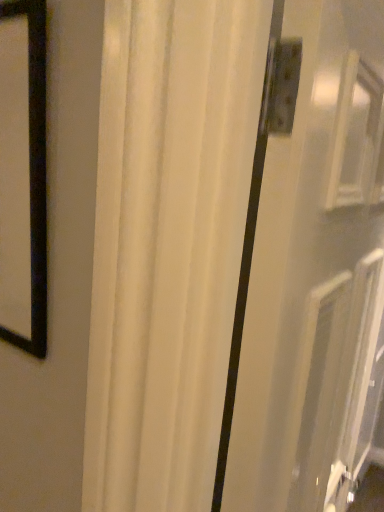
What is the approximate width of white glossy screen door at center?

4.01 inches.

The image size is (384, 512). Describe the element at coordinates (314, 268) in the screenshot. I see `white glossy screen door at center` at that location.

You are a GUI agent. You are given a task and a screenshot of the screen. Output one action in this format:
    pyautogui.click(x=<x>, y=<y>)
    Task: Click on the white glossy screen door at center
    
    Given the screenshot: What is the action you would take?
    pyautogui.click(x=314, y=268)

The image size is (384, 512). Find the location of `white matte curtain at center`. white matte curtain at center is located at coordinates (168, 244).

The height and width of the screenshot is (512, 384). Describe the element at coordinates (168, 244) in the screenshot. I see `white matte curtain at center` at that location.

Locate an element on the screen. Image resolution: width=384 pixels, height=512 pixels. white glossy screen door at center is located at coordinates (314, 268).

Considering the positions of objects white glossy screen door at center and white matte curtain at center in the image provided, who is more to the left, white glossy screen door at center or white matte curtain at center?

From the viewer's perspective, white glossy screen door at center appears more on the left side.

Considering the positions of objects white glossy screen door at center and white matte curtain at center in the image provided, who is in front, white glossy screen door at center or white matte curtain at center?

white glossy screen door at center is more forward.

Which is farther from the camera, (315, 332) or (166, 7)?

Point (315, 332)

From the image's perspective, is white glossy screen door at center located beneath white matte curtain at center?

No.

From a real-world perspective, is white glossy screen door at center physically below white matte curtain at center?

Incorrect, from a real-world perspective, white glossy screen door at center is higher than white matte curtain at center.

Which object is thinner, white glossy screen door at center or white matte curtain at center?

white glossy screen door at center is thinner.

Is white glossy screen door at center shorter than white matte curtain at center?

Yes.

Is white glossy screen door at center bigger than white matte curtain at center?

Incorrect, white glossy screen door at center is not larger than white matte curtain at center.

Based on the photo, is white matte curtain at center a part of white glossy screen door at center?

No, white glossy screen door at center does not contain white matte curtain at center.

Is white glossy screen door at center positioned far away from white matte curtain at center?

white glossy screen door at center is near white matte curtain at center, not far away.

Does white glossy screen door at center turn towards white matte curtain at center?

No, white glossy screen door at center is not oriented towards white matte curtain at center.

Locate an element on the screen. The width and height of the screenshot is (384, 512). screen door above the white matte curtain at center (from the image's perspective) is located at coordinates (314, 268).

Considering the positions of objects white matte curtain at center and white glossy screen door at center in the image provided, who is more to the left, white matte curtain at center or white glossy screen door at center?

white glossy screen door at center.

Is white matte curtain at center further to camera compared to white glossy screen door at center?

Yes, white matte curtain at center is further from the camera.

Between point (126, 232) and point (266, 230), which one is positioned in front?

The point (126, 232) is in front.

From the image's perspective, which object appears higher, white matte curtain at center or white glossy screen door at center?

white glossy screen door at center, from the image's perspective.

From a real-world perspective, is white matte curtain at center positioned over white glossy screen door at center based on gravity?

No, from a real-world perspective, white matte curtain at center is not over white glossy screen door at center

Can you confirm if white matte curtain at center is thinner than white glossy screen door at center?

In fact, white matte curtain at center might be wider than white glossy screen door at center.

Who is taller, white matte curtain at center or white glossy screen door at center?

white matte curtain at center.

Considering the relative sizes of white matte curtain at center and white glossy screen door at center in the image provided, is white matte curtain at center smaller than white glossy screen door at center?

No.

Is white matte curtain at center located outside white glossy screen door at center?

Yes, white matte curtain at center is located beyond the bounds of white glossy screen door at center.

Is white matte curtain at center far from white glossy screen door at center?

Actually, white matte curtain at center and white glossy screen door at center are a little close together.

Is white matte curtain at center aimed at white glossy screen door at center?

Yes, white matte curtain at center is facing white glossy screen door at center.

Can you tell me how much white matte curtain at center and white glossy screen door at center differ in facing direction?

1.7 degrees.

Measure the distance from white matte curtain at center to white glossy screen door at center.

white matte curtain at center and white glossy screen door at center are 24.91 centimeters apart from each other.

Find the location of a particular element. screen door lying in front of the white matte curtain at center is located at coordinates (314, 268).

I want to click on curtain on the right side of white glossy screen door at center, so click(168, 244).

Find the location of a particular element. curtain below the white glossy screen door at center (from a real-world perspective) is located at coordinates (168, 244).